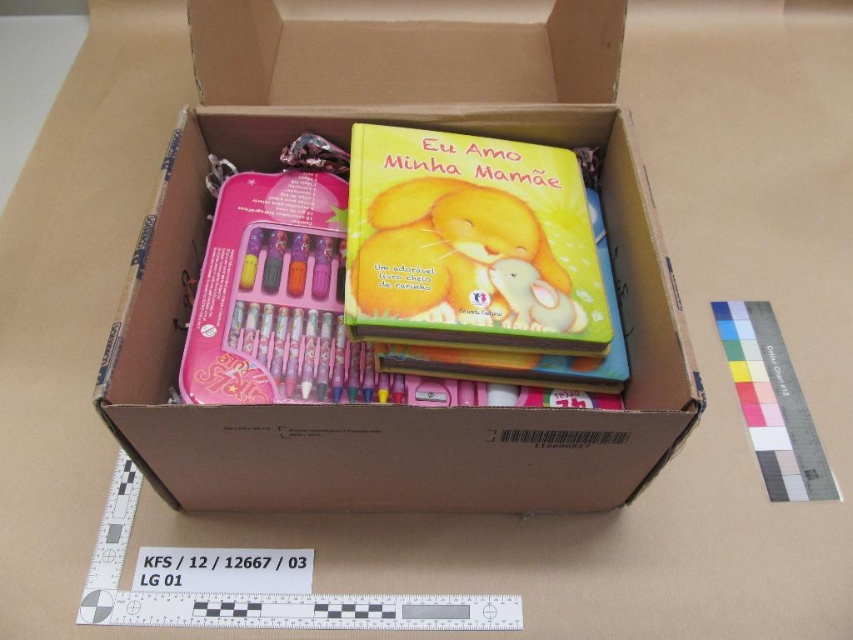
What do you see at coordinates (343, 145) in the screenshot? This screenshot has height=640, width=853. I see `matte cardboard box at center` at bounding box center [343, 145].

Between matte cardboard box at center and white plastic ruler at upper right, which one has less height?

white plastic ruler at upper right is shorter.

Is point (218, 486) closer to camera compared to point (786, 442)?

Yes, point (218, 486) is in front of point (786, 442).

Identify the location of matte cardboard box at center. (343, 145).